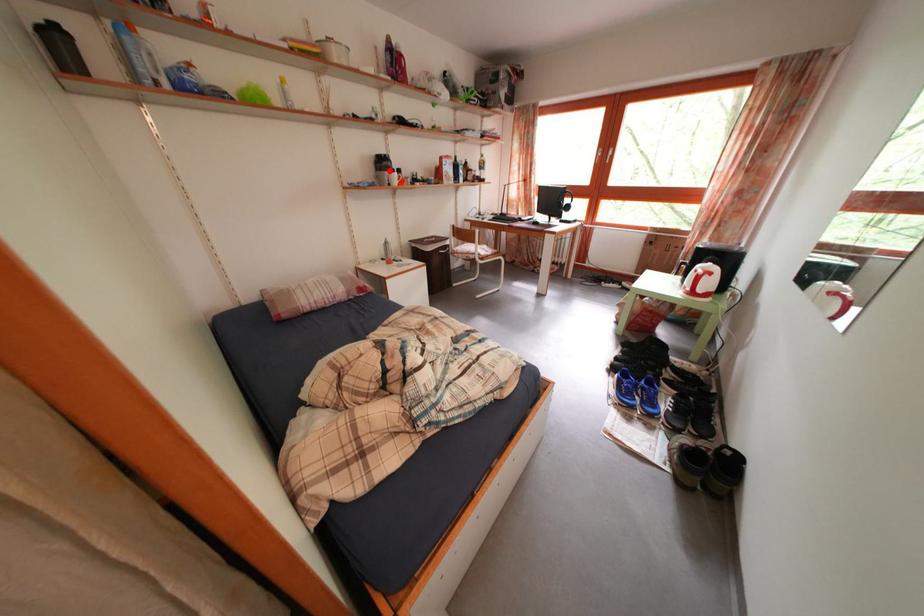
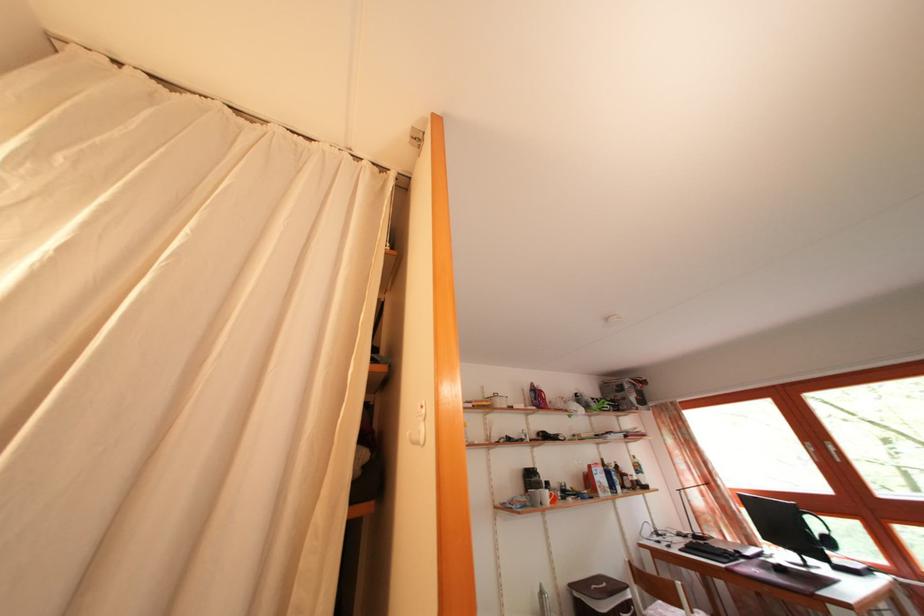
Where in the second image is the point corresponding to the highlighted location from the first image?

(538, 484)